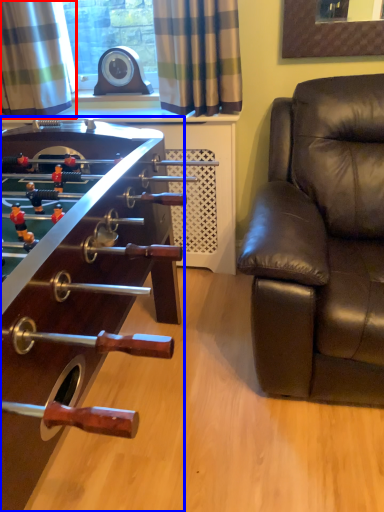
Question: Which object is closer to the camera taking this photo, curtain (highlighted by a red box) or table (highlighted by a blue box)?

Choices:
 (A) curtain
 (B) table

Answer: (B)